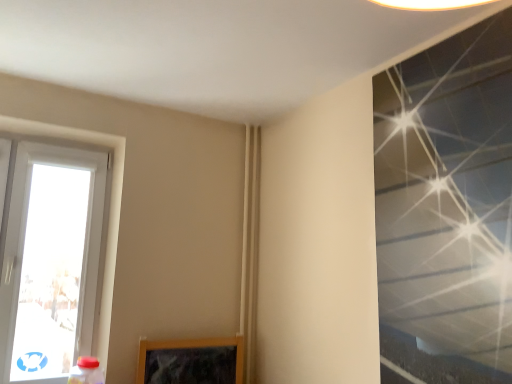
Question: Is transparent glass window at upper right, which ranks as the 2th window in back-to-front order, taller than white plastic window at left, the 1th window from the left?

Choices:
 (A) yes
 (B) no

Answer: (A)

Question: Is transparent glass window at upper right, the first window viewed from the right, aimed at white plastic window at left, the 1th window from the left?

Choices:
 (A) yes
 (B) no

Answer: (B)

Question: From a real-world perspective, is transparent glass window at upper right, the 2th window from the left, on white plastic window at left, which appears as the first window when viewed from the back?

Choices:
 (A) no
 (B) yes

Answer: (B)

Question: Is white plastic window at left, which appears as the first window when viewed from the back, at the back of transparent glass window at upper right, the first window viewed from the right?

Choices:
 (A) yes
 (B) no

Answer: (B)

Question: Is the depth of transparent glass window at upper right, the first window viewed from the right, less than that of white plastic window at left, the 1th window from the left?

Choices:
 (A) no
 (B) yes

Answer: (B)

Question: Considering the relative positions of transparent glass window at upper right, the first window viewed from the right, and white plastic window at left, the 2th window positioned from the front, in the image provided, is transparent glass window at upper right, the first window viewed from the right, to the left of white plastic window at left, the 2th window positioned from the front, from the viewer's perspective?

Choices:
 (A) no
 (B) yes

Answer: (A)

Question: From the image's perspective, is white plastic window at left, the 2th window positioned from the front, located beneath transparent glass window at upper right, the 2th window from the left?

Choices:
 (A) no
 (B) yes

Answer: (B)

Question: Does white plastic window at left, the 2th window positioned from the front, lie behind transparent glass window at upper right, the 2th window from the left?

Choices:
 (A) no
 (B) yes

Answer: (B)

Question: From the image's perspective, is white plastic window at left, the second window in the right-to-left sequence, located above transparent glass window at upper right, the first window positioned from the front?

Choices:
 (A) no
 (B) yes

Answer: (A)

Question: Does white plastic window at left, which appears as the first window when viewed from the back, turn towards transparent glass window at upper right, which ranks as the 2th window in back-to-front order?

Choices:
 (A) yes
 (B) no

Answer: (B)

Question: Does white plastic window at left, the 1th window from the left, have a greater height compared to transparent glass window at upper right, which ranks as the 2th window in back-to-front order?

Choices:
 (A) no
 (B) yes

Answer: (A)

Question: Is white plastic window at left, the 1th window from the left, next to transparent glass window at upper right, which ranks as the 2th window in back-to-front order, and touching it?

Choices:
 (A) no
 (B) yes

Answer: (A)

Question: Is transparent glass window at upper right, the first window viewed from the right, inside the boundaries of white plastic window at left, the 2th window positioned from the front, or outside?

Choices:
 (A) inside
 (B) outside

Answer: (B)